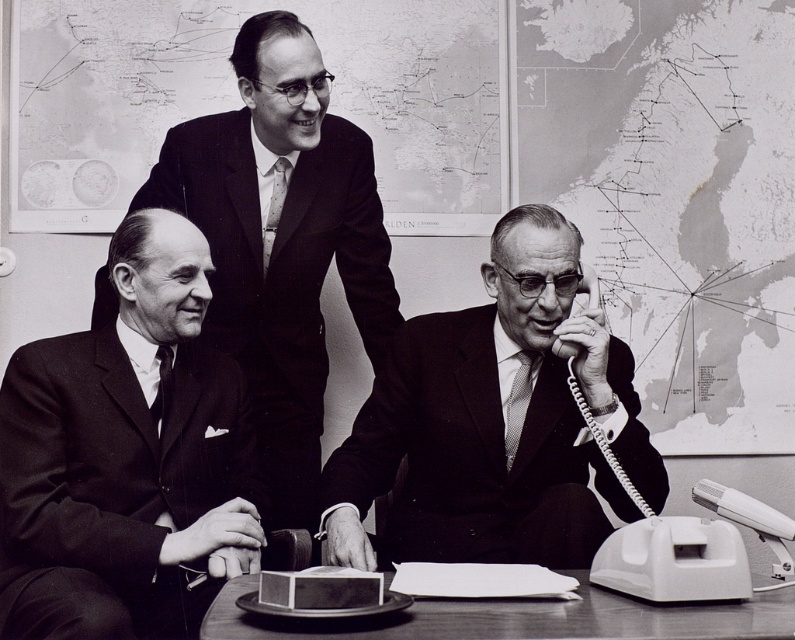
You are organizing a meeting in an office and need to ensure that all attendees can comfortably sit around the smooth wooden table at lower center. Given that the matte black suit at center is taking up space, do you think there is enough room for everyone?

The matte black suit at center has a larger size compared to the smooth wooden table at lower center, which means the table might be too small to accommodate everyone comfortably with the larger object occupying space.

You are an observer in the scene. You see the matte black suit at left and the matte black suit at upper center. Which one is positioned lower in the image?

The matte black suit at left is located below the matte black suit at upper center, so it is positioned lower in the image.

You are a photographer who needs to capture a closeup of the matte black suit at center without including the smooth wooden table at lower center in the frame. Based on their positions, is this possible?

The smooth wooden table at lower center is behind the matte black suit at center, so if the photographer positions themselves to focus on the front of the matte black suit at center, they can avoid including the table in the frame.